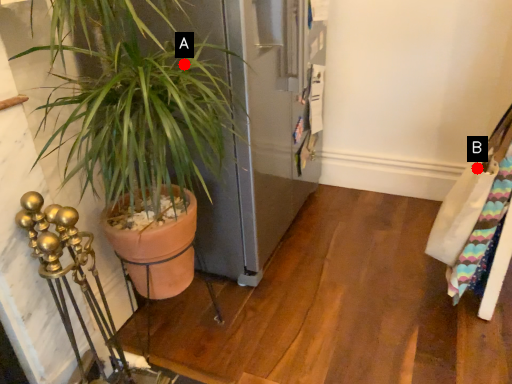
Question: Two points are circled on the image, labeled by A and B beside each circle. Which point appears closest to the camera in this image?

Choices:
 (A) A is closer
 (B) B is closer

Answer: (A)